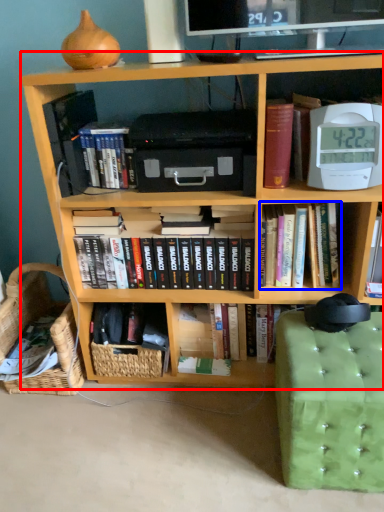
Question: Which object is closer to the camera taking this photo, bookcase (highlighted by a red box) or book (highlighted by a blue box)?

Choices:
 (A) bookcase
 (B) book

Answer: (A)